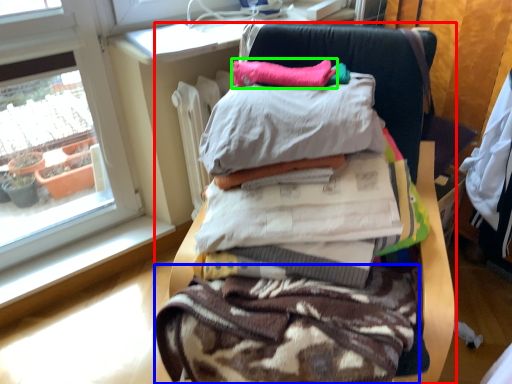
Question: Based on their relative distances, which object is farther from furniture (highlighted by a red box)? Choose from fabric (highlighted by a blue box) and pillow (highlighted by a green box).

Choices:
 (A) fabric
 (B) pillow

Answer: (A)